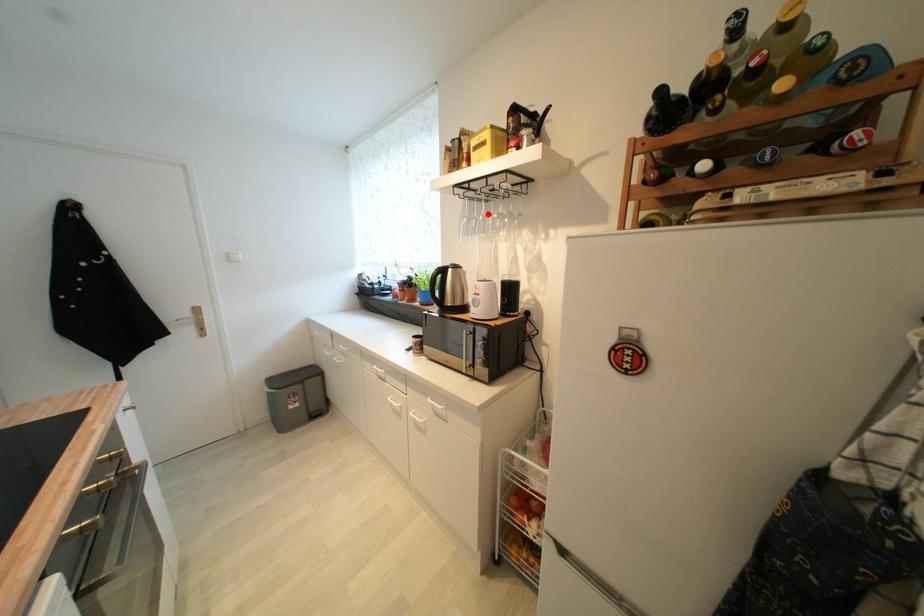
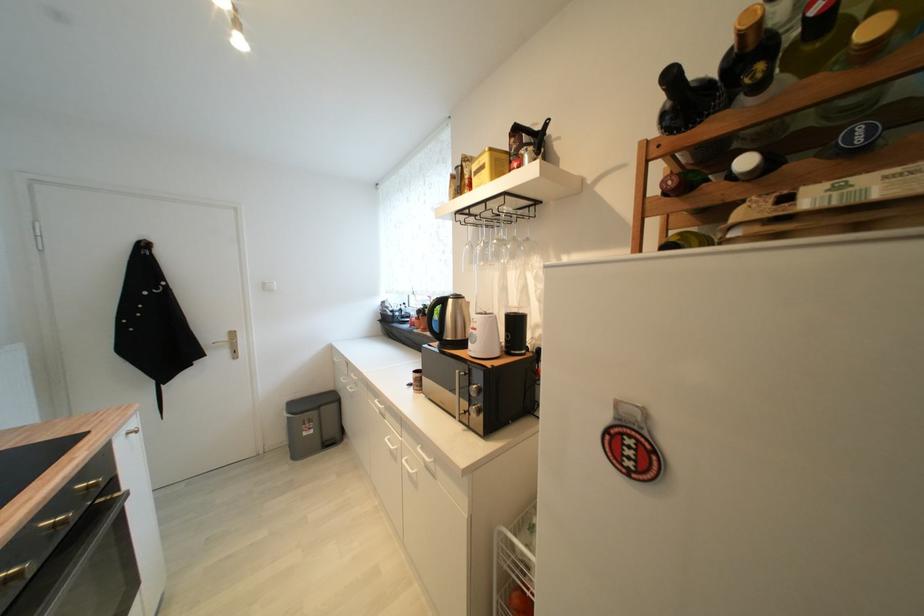
Find the pixel in the second image that matches the highlighted location in the first image.

(489, 240)